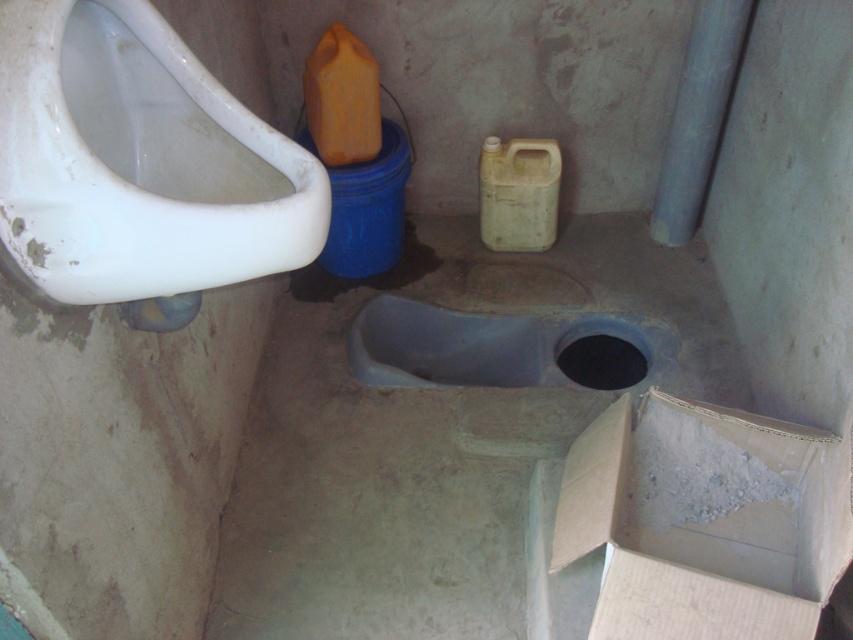
Who is positioned more to the left, white glossy urinal at left or matte plastic toilet bowl at center?

white glossy urinal at left is more to the left.

Between white glossy urinal at left and matte plastic toilet bowl at center, which one is positioned lower?

Positioned lower is white glossy urinal at left.

Find the location of a particular element. white glossy urinal at left is located at coordinates (138, 161).